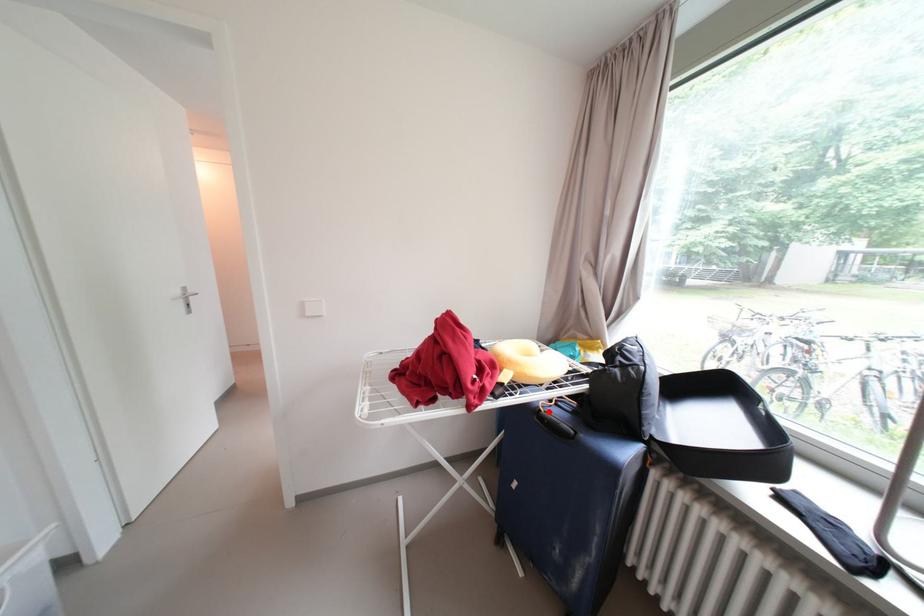
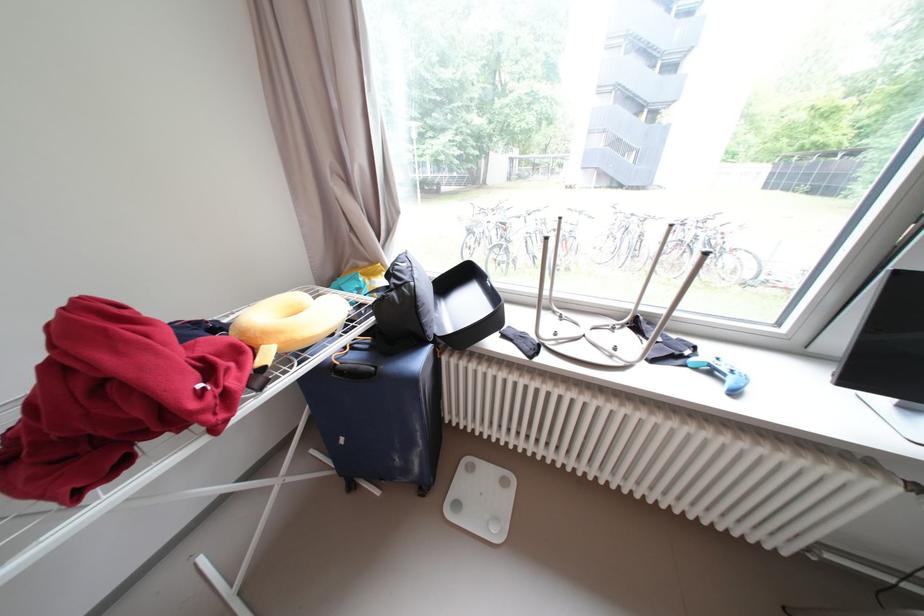
Locate, in the second image, the point that corresponds to the highlighted location in the first image.

(344, 366)